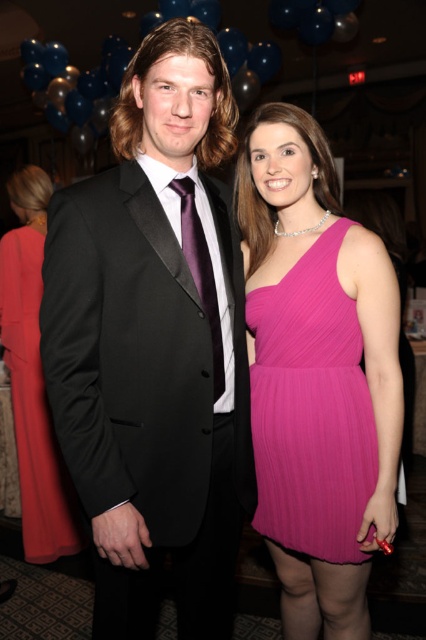
Looking at this image, you are standing at the edge of the event venue and see the black satin suit at center. If you want to approach and hand over a 15 cm wide invitation card, will you be able to do so without moving closer than your current position?

The black satin suit at center and viewer are 1.17 meters apart from each other. Since the invitation card is 15 cm wide, you can extend your arm to hand it over without needing to move closer than your current position as 1.17 meters is sufficient distance for arm extension.

You are a photographer at a gala event and need to adjust the lighting to ensure both the black satin suit at center and the silky red dress at center are well illuminated. Given their sizes, which of the two requires a wider light spread to cover its entirety?

The black satin suit at center is bigger than the silky red dress at center, so it requires a wider light spread to cover its entirety.

You are a photographer at a gala event and need to adjust the lighting to ensure both the black satin suit at center and the silky red dress at center are well lit. Given their positions, which one is higher up and requires more upward adjustment?

The black satin suit at center is above the silky red dress at center, so it requires more upward adjustment to ensure proper lighting.